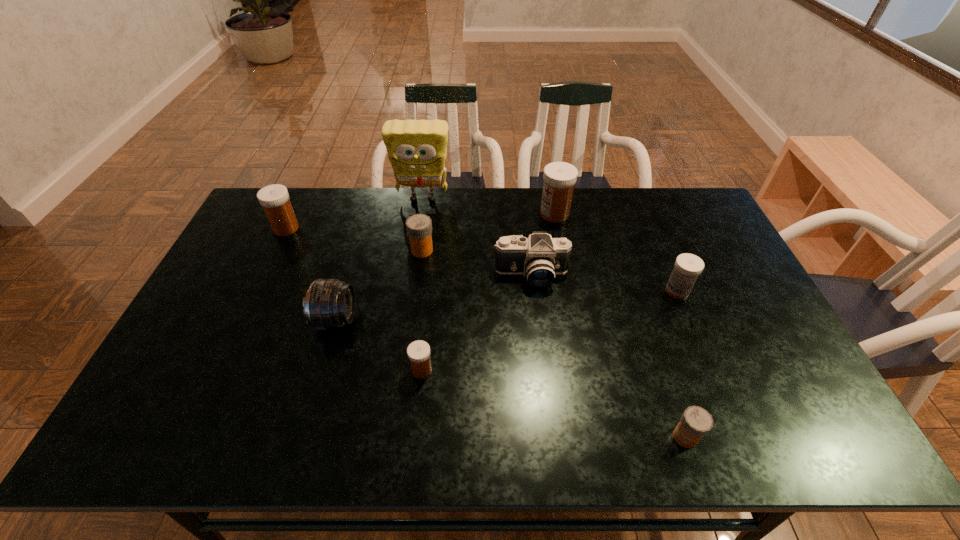
What are the coordinates of `the third biggest white medicine` in the screenshot? It's located at coord(687,267).

Locate an element on the screen. The image size is (960, 540). the second nearest white medicine is located at coordinates (687, 267).

Locate an element on the screen. the eighth farthest object is located at coordinates (418, 352).

Image resolution: width=960 pixels, height=540 pixels. In order to click on the nearest white medicine in this screenshot , I will do `click(418, 352)`.

This screenshot has width=960, height=540. I want to click on the smaller orange medicine, so click(696, 422).

Where is `the second medicine from right to left`? This screenshot has width=960, height=540. the second medicine from right to left is located at coordinates (696, 422).

The height and width of the screenshot is (540, 960). Identify the location of vacant space situated on the face of the sponge. pos(410,282).

Locate an element on the screen. free spot located on the right of the tallest medicine is located at coordinates (595, 214).

Where is `vacant space located 0.230m on the right of the leftmost object`? This screenshot has height=540, width=960. vacant space located 0.230m on the right of the leftmost object is located at coordinates (366, 228).

The width and height of the screenshot is (960, 540). I want to click on vacant space located on the back of the black camera, so click(x=523, y=204).